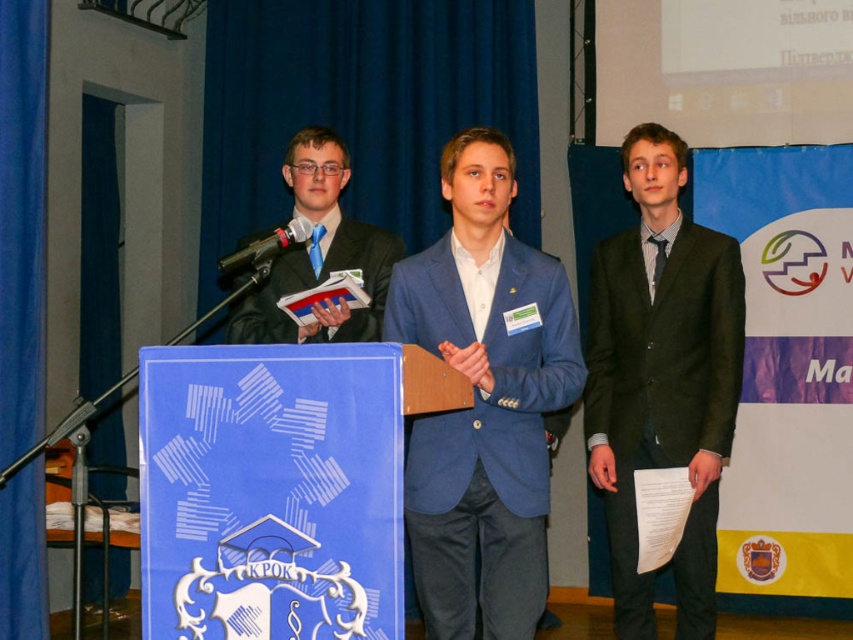
Does point (734, 310) lie behind point (270, 285)?

No, (734, 310) is closer to viewer.

Looking at this image, measure the distance between dark gray suit at right and camera.

dark gray suit at right is 3.73 meters away from camera.

Image resolution: width=853 pixels, height=640 pixels. Identify the location of dark gray suit at right. (662, 378).

Which is below, matte black suit at center or black metallic microphone at center?

Positioned lower is black metallic microphone at center.

Between matte black suit at center and black metallic microphone at center, which one appears on the right side from the viewer's perspective?

matte black suit at center is more to the right.

What do you see at coordinates (318, 253) in the screenshot? This screenshot has height=640, width=853. I see `matte black suit at center` at bounding box center [318, 253].

At what (x,y) coordinates should I click in order to perform the action: click on matte black suit at center. Please return your answer as a coordinate pair (x, y). The width and height of the screenshot is (853, 640). Looking at the image, I should click on (318, 253).

Who is more forward, (x=711, y=509) or (x=479, y=536)?

Point (x=479, y=536)

The height and width of the screenshot is (640, 853). What do you see at coordinates (662, 378) in the screenshot?
I see `dark gray suit at right` at bounding box center [662, 378].

You are a GUI agent. You are given a task and a screenshot of the screen. Output one action in this format:
    pyautogui.click(x=<x>, y=<y>)
    Task: Click on the dark gray suit at right
    This screenshot has width=853, height=640.
    Given the screenshot: What is the action you would take?
    pyautogui.click(x=662, y=378)